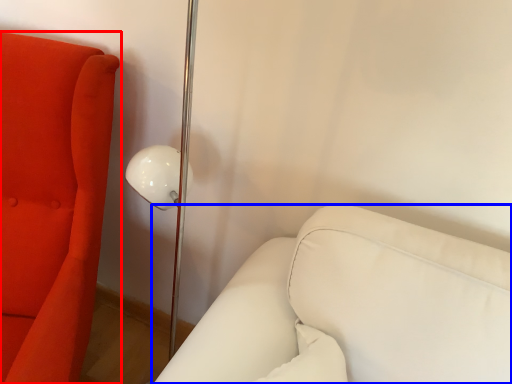
Question: Among these objects, which one is farthest to the camera, furniture (highlighted by a red box) or furniture (highlighted by a blue box)?

Choices:
 (A) furniture
 (B) furniture

Answer: (B)